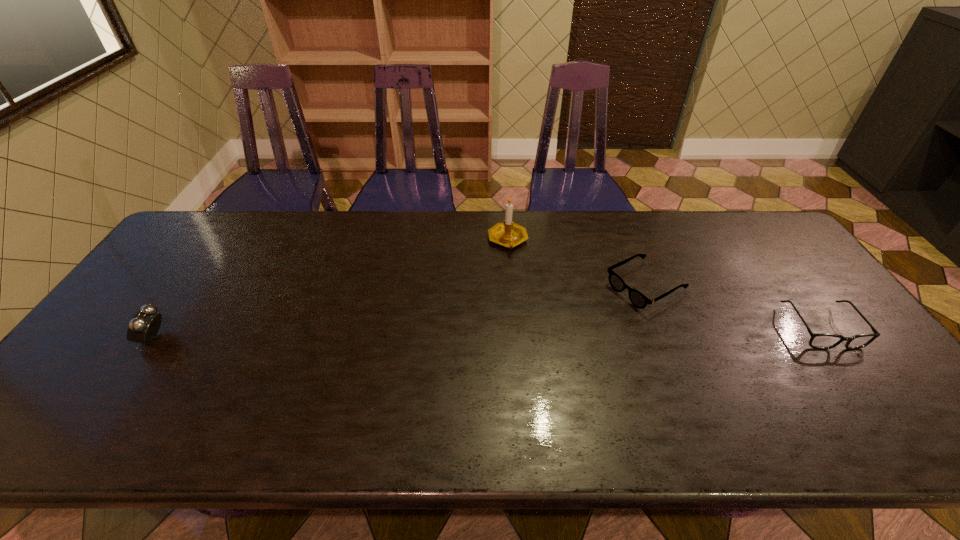
The width and height of the screenshot is (960, 540). In order to click on vacant position located on the arms of the second object from right to left in this screenshot , I will do `click(599, 312)`.

The image size is (960, 540). Identify the location of vacant region located on the arms of the second object from right to left. (571, 327).

Find the location of a particular element. Image resolution: width=960 pixels, height=540 pixels. vacant position located with a handle on the farthest object is located at coordinates (544, 284).

Identify the location of free space located 0.120m with a handle on the farthest object. (539, 277).

Where is `vacant space positioned with a handle on the farthest object`? The width and height of the screenshot is (960, 540). vacant space positioned with a handle on the farthest object is located at coordinates (581, 325).

At what (x,y) coordinates should I click in order to perform the action: click on object present at the far edge. Please return your answer as a coordinate pair (x, y). Looking at the image, I should click on (509, 234).

Where is `object that is at the left edge`? This screenshot has height=540, width=960. object that is at the left edge is located at coordinates (144, 326).

Image resolution: width=960 pixels, height=540 pixels. Identify the location of object that is at the right edge. point(818,341).

Locate an element on the screen. vacant space at the far edge of the desktop is located at coordinates (456, 224).

This screenshot has height=540, width=960. In the image, there is a desktop. What are the coordinates of `vacant space at the near edge` in the screenshot? It's located at (305, 397).